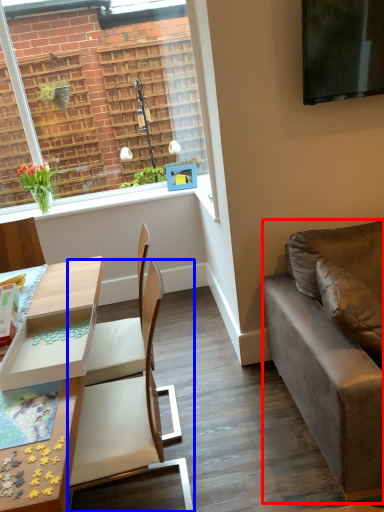
Question: Among these objects, which one is nearest to the camera, studio couch (highlighted by a red box) or chair (highlighted by a blue box)?

Choices:
 (A) studio couch
 (B) chair

Answer: (B)